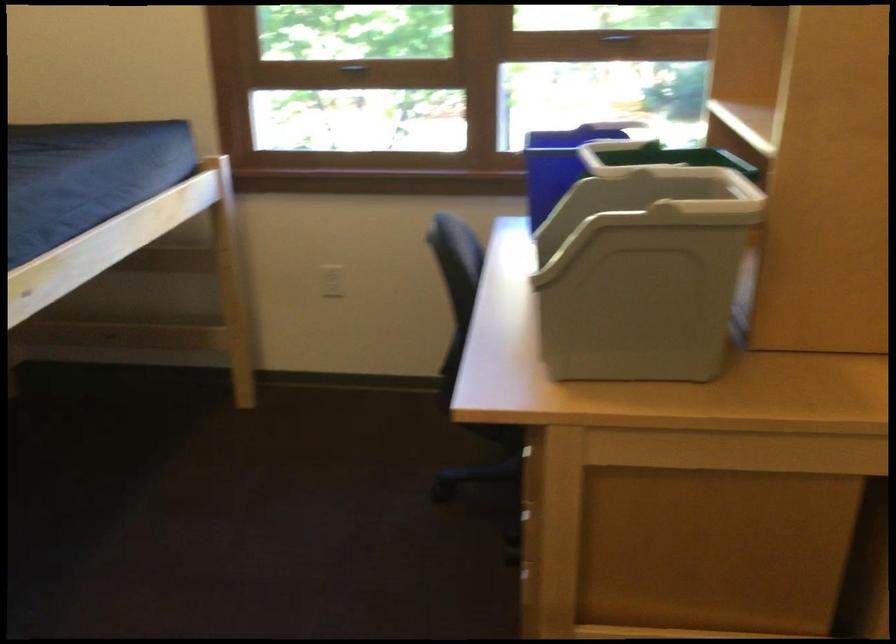
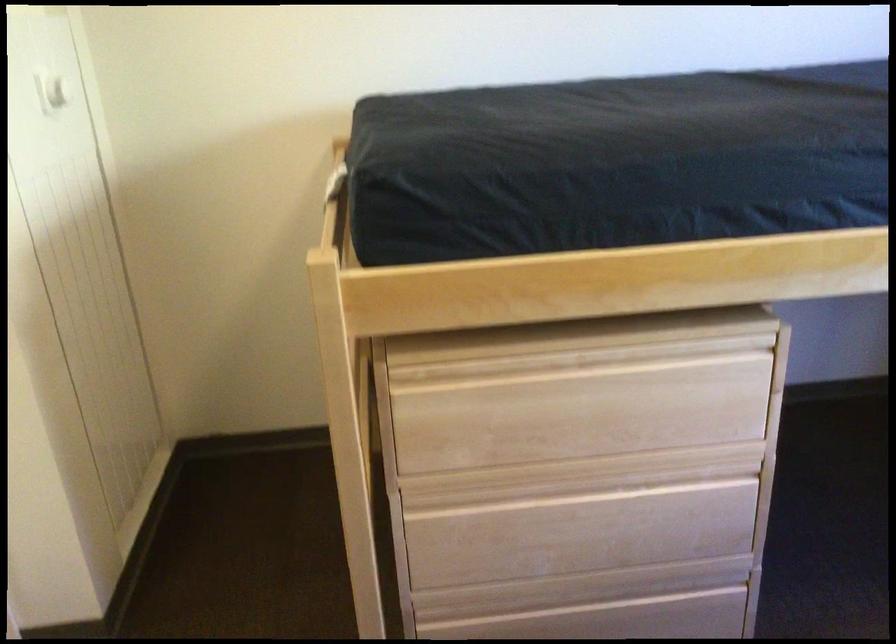
First-person continuous shooting, in which direction is the camera rotating?

The camera's rotation is toward left-down.